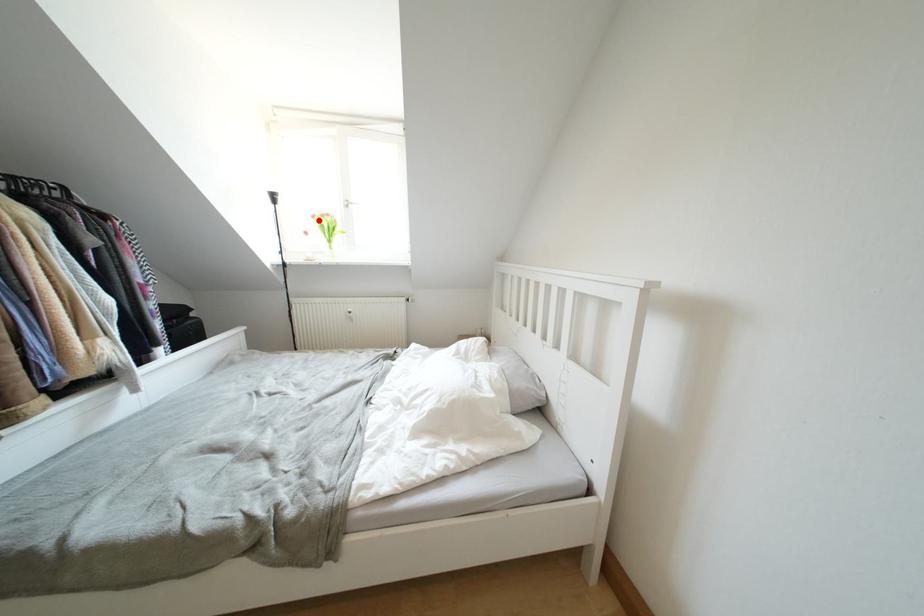
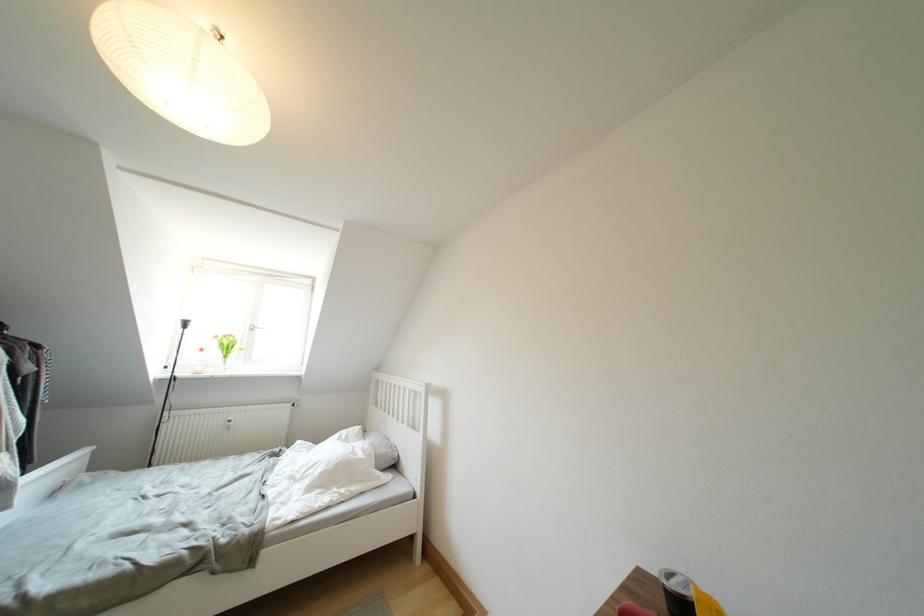
The point at the highlighted location is marked in the first image. Where is the corresponding point in the second image?

(222, 341)